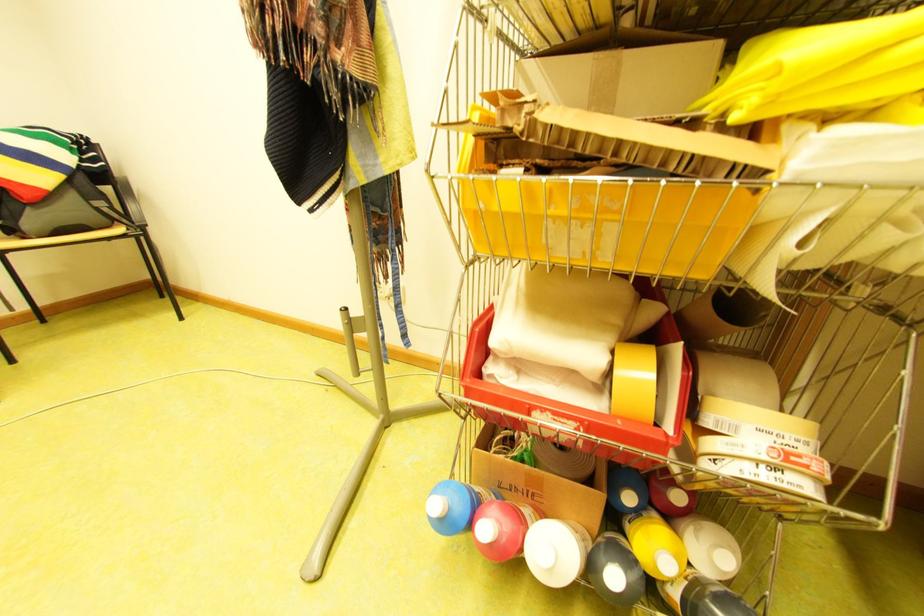
Where would you pull the red plastic bin? Please return your answer as a coordinate pair (x, y).

(592, 435)